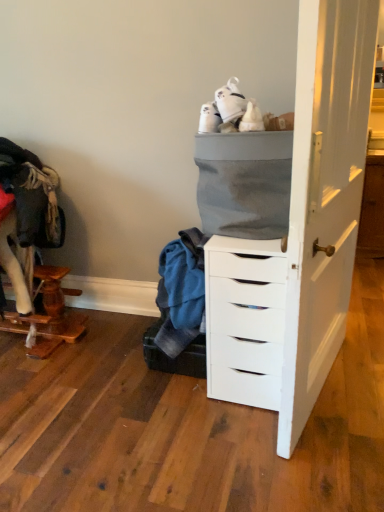
Question: Does wooden cat tree at left have a greater height compared to white matte chest of drawers at center?

Choices:
 (A) no
 (B) yes

Answer: (A)

Question: Is wooden cat tree at left far away from white matte chest of drawers at center?

Choices:
 (A) yes
 (B) no

Answer: (A)

Question: Can you confirm if wooden cat tree at left is smaller than white matte chest of drawers at center?

Choices:
 (A) yes
 (B) no

Answer: (B)

Question: Does wooden cat tree at left lie behind white matte chest of drawers at center?

Choices:
 (A) yes
 (B) no

Answer: (A)

Question: From a real-world perspective, is wooden cat tree at left over white matte chest of drawers at center?

Choices:
 (A) yes
 (B) no

Answer: (B)

Question: In terms of width, does white matte chest of drawers at center look wider or thinner when compared to gray fabric basket at upper center?

Choices:
 (A) wide
 (B) thin

Answer: (A)

Question: Is white matte chest of drawers at center taller or shorter than gray fabric basket at upper center?

Choices:
 (A) short
 (B) tall

Answer: (B)

Question: Considering their positions, is white matte chest of drawers at center located in front of or behind gray fabric basket at upper center?

Choices:
 (A) front
 (B) behind

Answer: (B)

Question: Based on their sizes in the image, would you say white matte chest of drawers at center is bigger or smaller than gray fabric basket at upper center?

Choices:
 (A) big
 (B) small

Answer: (A)

Question: Does point (56, 297) appear closer or farther from the camera than point (256, 184)?

Choices:
 (A) closer
 (B) farther

Answer: (B)

Question: Based on their sizes in the image, would you say wooden cat tree at left is bigger or smaller than gray fabric basket at upper center?

Choices:
 (A) big
 (B) small

Answer: (A)

Question: Considering the positions of wooden cat tree at left and gray fabric basket at upper center in the image, is wooden cat tree at left taller or shorter than gray fabric basket at upper center?

Choices:
 (A) short
 (B) tall

Answer: (A)

Question: Is wooden cat tree at left spatially inside gray fabric basket at upper center, or outside of it?

Choices:
 (A) inside
 (B) outside

Answer: (B)

Question: In the image, is wooden cat tree at left on the left side or the right side of white matte chest of drawers at center?

Choices:
 (A) left
 (B) right

Answer: (A)

Question: Considering the positions of wooden cat tree at left and white matte chest of drawers at center in the image, is wooden cat tree at left taller or shorter than white matte chest of drawers at center?

Choices:
 (A) short
 (B) tall

Answer: (A)